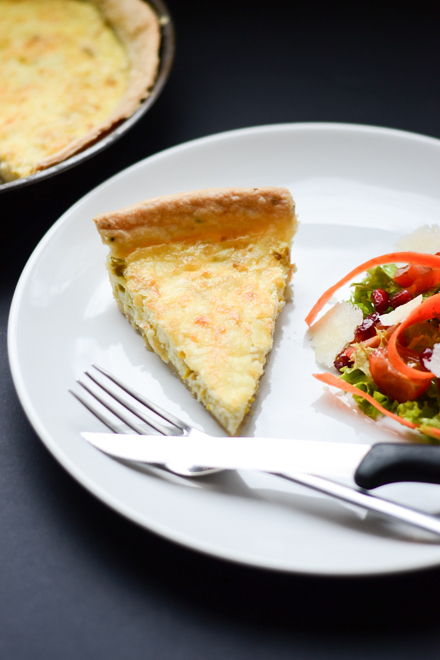
Identify the location of white plate. This screenshot has width=440, height=660. (356, 137).